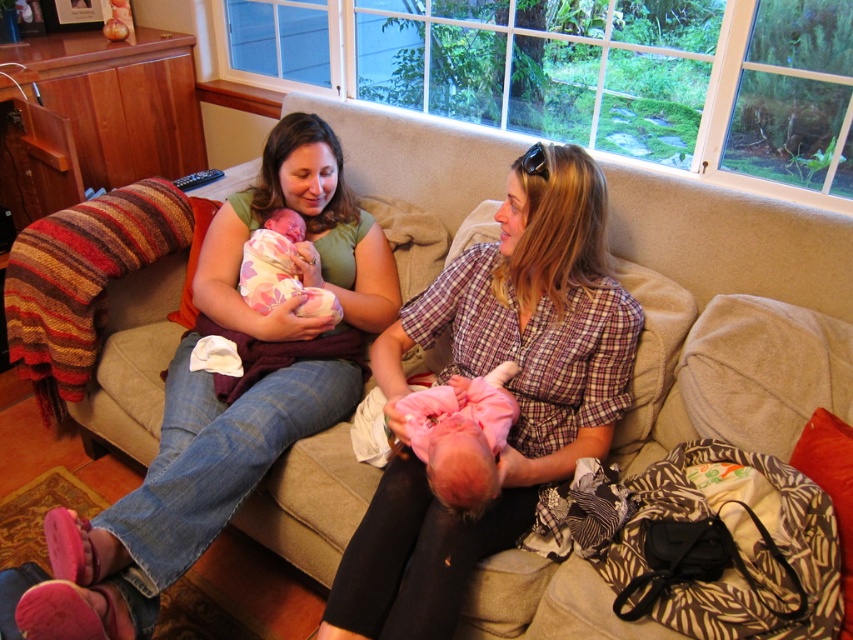
Does matte green shirt at upper left come behind matte plaid shirt at center?

No, matte green shirt at upper left is in front of matte plaid shirt at center.

Can you confirm if matte green shirt at upper left is taller than matte plaid shirt at center?

Indeed, matte green shirt at upper left has a greater height compared to matte plaid shirt at center.

Identify the location of matte green shirt at upper left. This screenshot has width=853, height=640. (228, 396).

Is matte green shirt at upper left above pink soft fabric baby at center?

Indeed, matte green shirt at upper left is positioned over pink soft fabric baby at center.

Does matte green shirt at upper left have a larger size compared to pink soft fabric baby at center?

Indeed, matte green shirt at upper left has a larger size compared to pink soft fabric baby at center.

Locate an element on the screen. The width and height of the screenshot is (853, 640). matte green shirt at upper left is located at coordinates (228, 396).

What are the coordinates of `matte green shirt at upper left` in the screenshot? It's located at [x=228, y=396].

Which is more to the right, matte plaid shirt at center or fluffy pink blanket at center?

matte plaid shirt at center is more to the right.

Does matte plaid shirt at center have a greater height compared to fluffy pink blanket at center?

Yes, matte plaid shirt at center is taller than fluffy pink blanket at center.

This screenshot has height=640, width=853. In order to click on matte plaid shirt at center in this screenshot , I will do `click(506, 387)`.